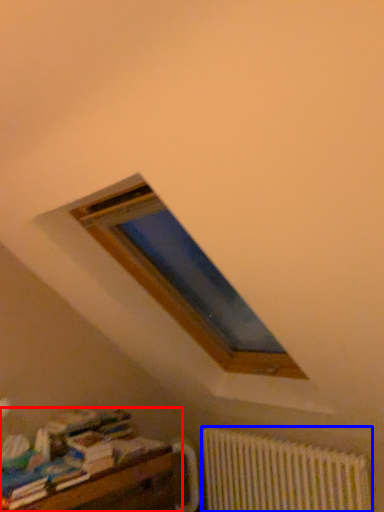
Question: Among these objects, which one is nearest to the camera, furniture (highlighted by a red box) or radiator (highlighted by a blue box)?

Choices:
 (A) furniture
 (B) radiator

Answer: (A)